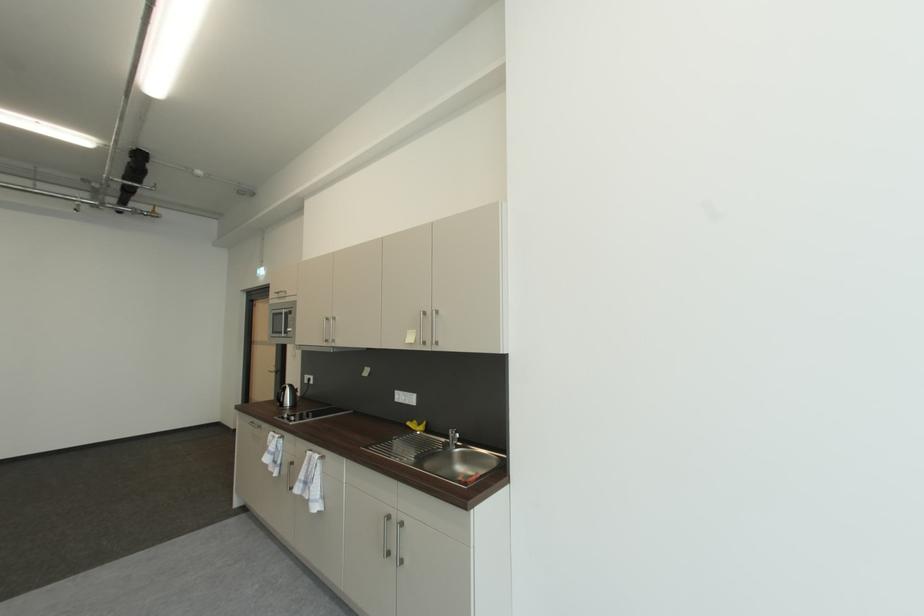
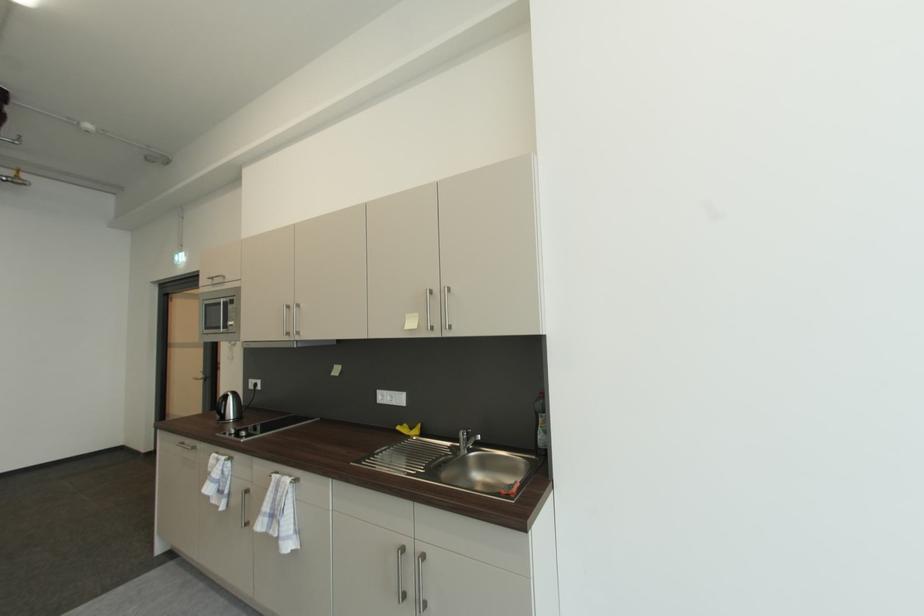
Question: The camera is either moving clockwise (left) or counter-clockwise (right) around the object. The first image is from the beginning of the video and the second image is from the end. Is the camera moving left or right when shooting the video?

Choices:
 (A) Left
 (B) Right

Answer: (A)